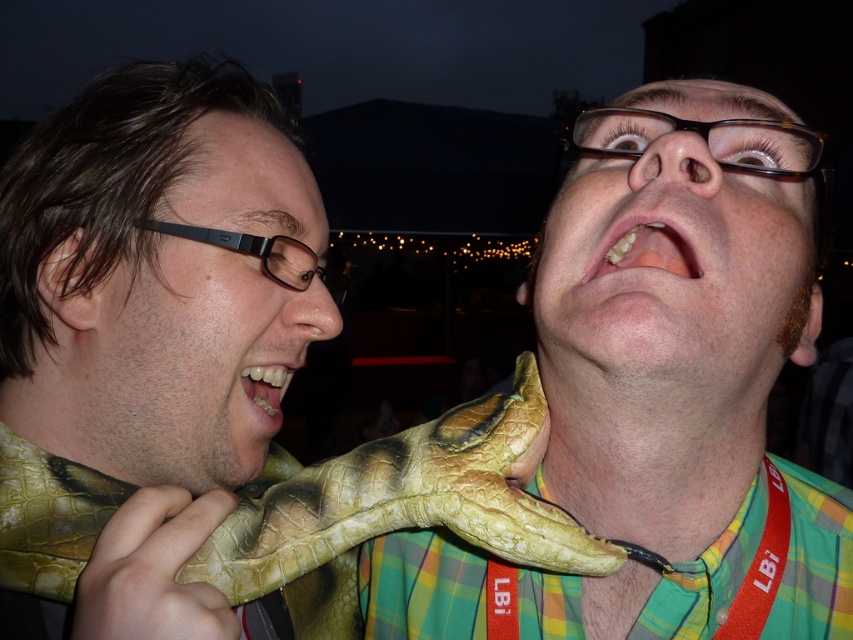
Question: Which object is positioned closest to the leather-like snake at right?

Choices:
 (A) matte black glasses at left
 (B) yellow matte teeth at center

Answer: (A)

Question: Based on their relative distances, which object is nearer to the matte black glasses at left?

Choices:
 (A) leather-like yellow neck at center
 (B) leathery yellow-green python at center
 (C) leather-like snake at right
 (D) matte black glasses at upper center

Answer: (C)

Question: Which object is farther from the camera taking this photo?

Choices:
 (A) leather-like yellow neck at center
 (B) leather-like yellow-green dinosaur hand at upper right
 (C) matte black glasses at left

Answer: (A)

Question: In this image, where is leathery yellow-green python at center located relative to leather-like tan hand at lower left?

Choices:
 (A) below
 (B) above

Answer: (A)

Question: Considering the relative positions of matte black glasses at left and teeth at center in the image provided, where is matte black glasses at left located with respect to teeth at center?

Choices:
 (A) below
 (B) above

Answer: (A)

Question: Is matte black glasses at left bigger than leather-like tan hand at lower left?

Choices:
 (A) no
 (B) yes

Answer: (B)